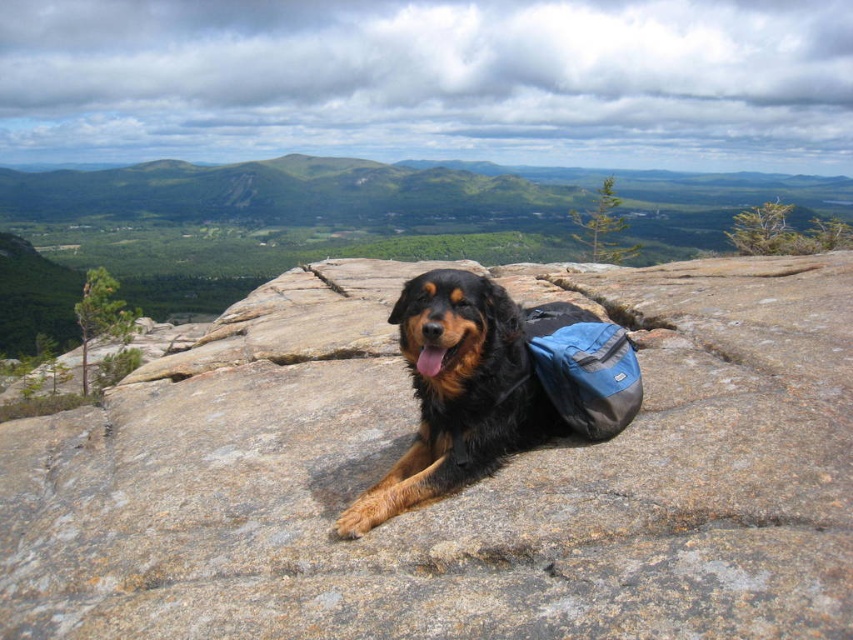
Question: Which point is closer to the camera?

Choices:
 (A) (102, 406)
 (B) (520, 428)

Answer: (B)

Question: Does brown rough rock at center appear on the right side of shiny brown fur at center?

Choices:
 (A) no
 (B) yes

Answer: (B)

Question: Which point is closer to the camera taking this photo?

Choices:
 (A) (196, 611)
 (B) (517, 445)

Answer: (A)

Question: Is brown rough rock at center thinner than shiny brown fur at center?

Choices:
 (A) yes
 (B) no

Answer: (B)

Question: Does brown rough rock at center appear over shiny brown fur at center?

Choices:
 (A) yes
 (B) no

Answer: (A)